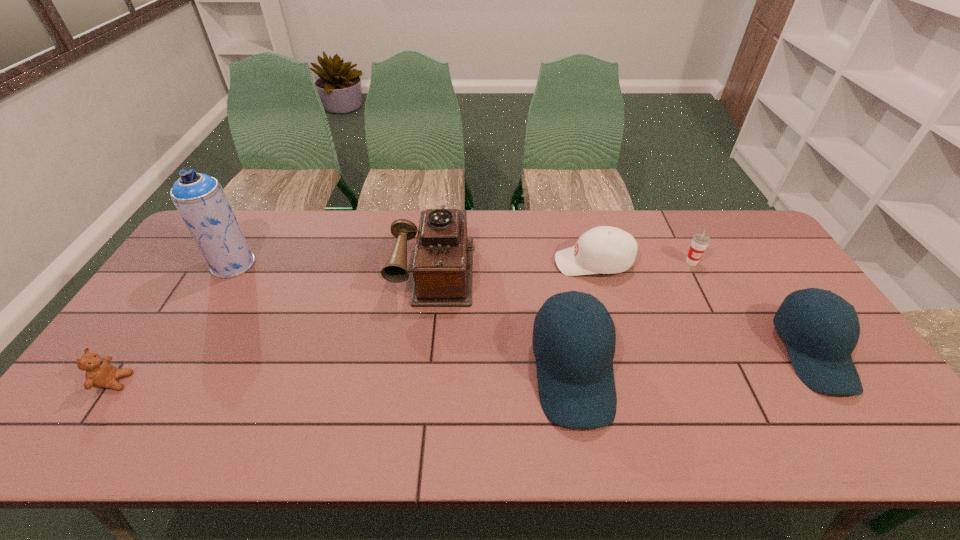
The height and width of the screenshot is (540, 960). Identify the location of the tallest baseball cap. (576, 386).

Find the location of `the rightmost object`. the rightmost object is located at coordinates point(820,351).

At what (x,y) coordinates should I click in order to perform the action: click on the rightmost baseball cap. Please return your answer as a coordinate pair (x, y). The width and height of the screenshot is (960, 540). Looking at the image, I should click on (820, 351).

Where is `the tallest object`? the tallest object is located at coordinates (199, 198).

Locate an element on the screen. aerosol can is located at coordinates (199, 198).

The image size is (960, 540). Identify the location of cup. (700, 241).

Locate an element on the screen. phonograph_record is located at coordinates (442, 269).

This screenshot has width=960, height=540. I want to click on the shortest baseball cap, so click(607, 250).

Identify the location of the leftmost object. The image size is (960, 540). (100, 373).

Identify the location of free location located 0.260m on the right of the sixth object from right to left. Image resolution: width=960 pixels, height=540 pixels. (336, 265).